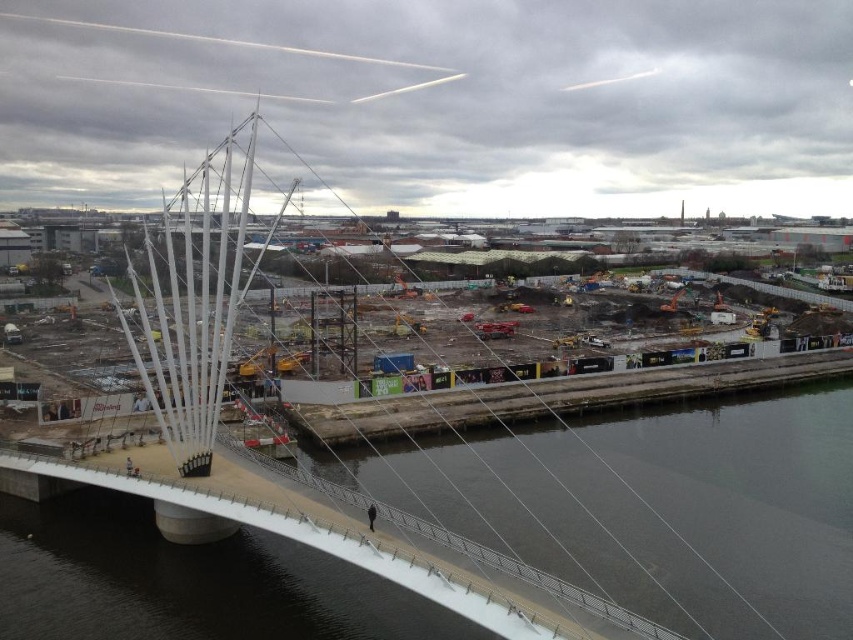
You are standing on the bridge and want to locate the concrete construction site at center. Based on the coordinates provided, where should you look relative to the bridge?

The concrete construction site at center is located at coordinates point [656,508], so you should look towards the center of the bridge.

You are a construction inspector standing on the bridge and see the concrete construction site at center and the dark gray concrete at center. Which one is closer to you?

The concrete construction site at center is closer to the viewer than the dark gray concrete at center.

You are a construction worker standing at the edge of the dark gray concrete at center and need to move to the concrete construction site at center. Which direction should you walk to reach it?

The concrete construction site at center is to the left of dark gray concrete at center, so you should walk to the left to reach it.